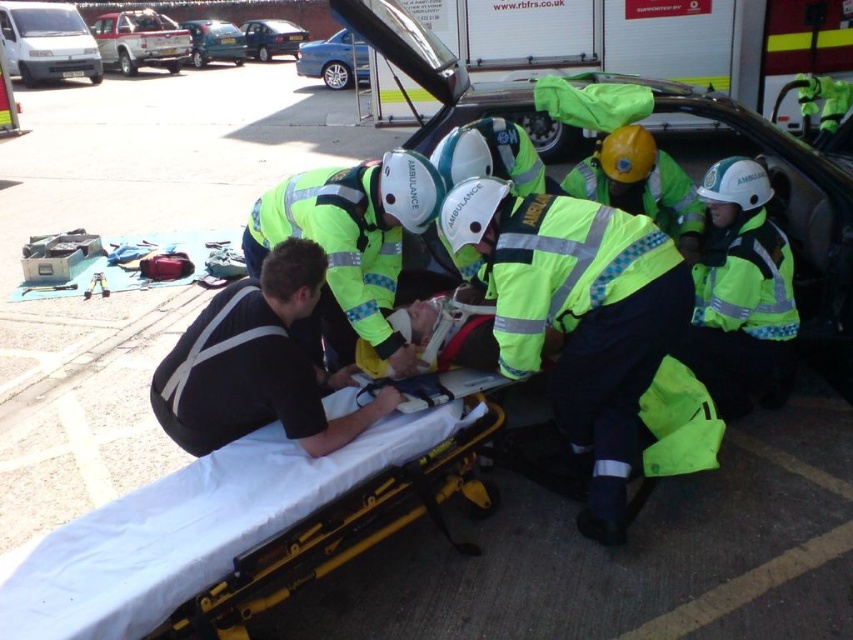
You are a paramedic trying to load the yellow metallic stretcher at lower left onto an ambulance. The ambulance door is located at point [238,529]. Is the stretcher already positioned correctly for loading?

The yellow metallic stretcher at lower left is located at point [238,529], which is where the ambulance door is. Therefore, the stretcher is already positioned correctly for loading.